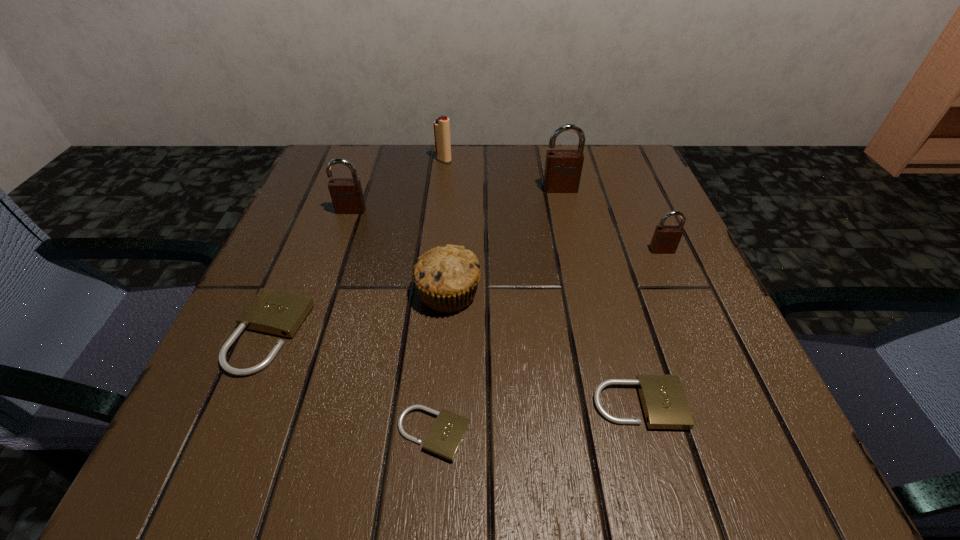
Locate an element on the screen. free space at the far left corner of the desktop is located at coordinates point(376,145).

At what (x,y) coordinates should I click in order to perform the action: click on vacant region at the near left corner of the desktop. Please return your answer as a coordinate pair (x, y). Looking at the image, I should click on (181, 452).

Find the location of a particular element. vacant space at the far right corner of the desktop is located at coordinates (636, 178).

I want to click on free spot between the second smallest brown padlock and the rightmost padlock, so click(x=506, y=231).

You are a GUI agent. You are given a task and a screenshot of the screen. Output one action in this format:
    pyautogui.click(x=<x>, y=<y>)
    Task: Click on the free spot between the muffin and the second shortest padlock
    This screenshot has height=540, width=960.
    Given the screenshot: What is the action you would take?
    pyautogui.click(x=543, y=349)

You are a GUI agent. You are given a task and a screenshot of the screen. Output one action in this format:
    pyautogui.click(x=<x>, y=<y>)
    Task: Click on the free space between the leftmost brown padlock and the muffin
    
    Given the screenshot: What is the action you would take?
    pyautogui.click(x=399, y=252)

The height and width of the screenshot is (540, 960). I want to click on vacant area that lies between the second shortest padlock and the farthest object, so point(541,282).

The image size is (960, 540). In order to click on free area in between the muffin and the fourth tallest padlock in this screenshot , I will do `click(359, 314)`.

I want to click on free spot between the smallest brown padlock and the igniter, so click(x=553, y=205).

This screenshot has width=960, height=540. Find the location of `vacant region between the second smallest beige padlock and the second nearest brown padlock`. vacant region between the second smallest beige padlock and the second nearest brown padlock is located at coordinates (494, 307).